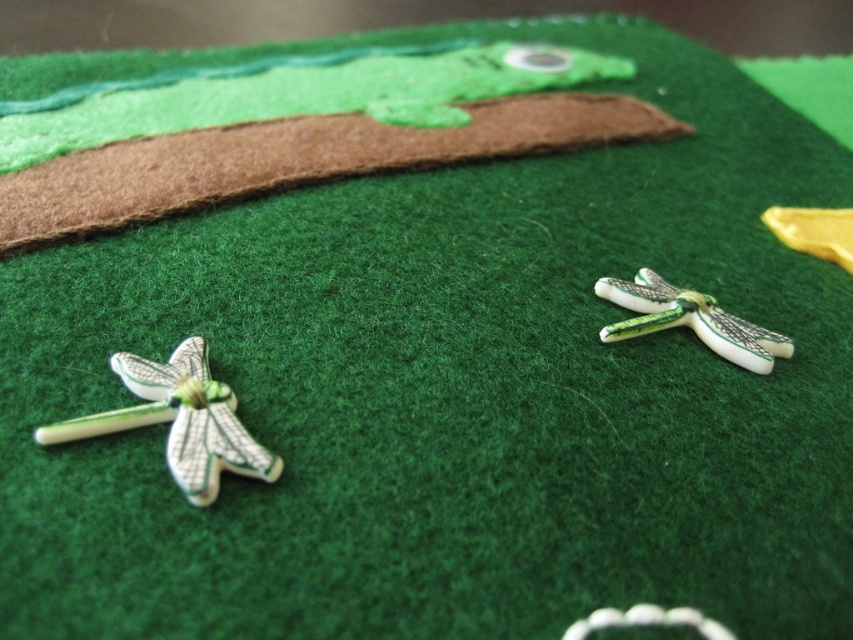
You are an artist creating a felt craft project. You have two dragonflies, the white glossy dragonfly at lower left and the green glossy dragonfly at right. Which dragonfly should you choose if you need a larger one for your project?

The white glossy dragonfly at lower left is larger in size than the green glossy dragonfly at right, so you should choose the white glossy dragonfly at lower left for your project.

You are an artist working on a felt craft project. You have a dragonfly labeled as white glossy dragonfly at lower left. Where exactly should you place it on the felt background?

The white glossy dragonfly at lower left should be placed at point (178, 420) on the felt background.